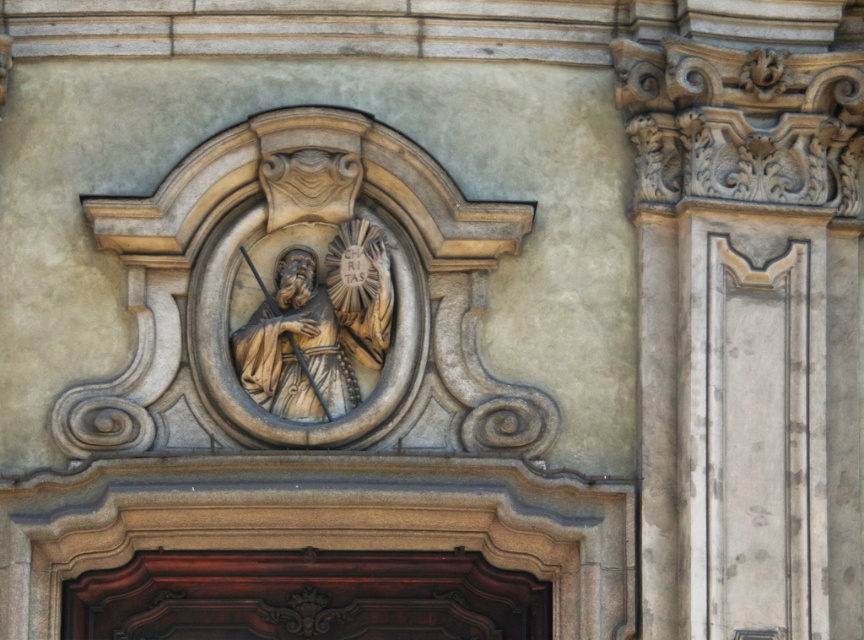
Question: Can you confirm if polished dark wood door at center is wider than matte stone statue at center?

Choices:
 (A) no
 (B) yes

Answer: (A)

Question: Can you confirm if polished dark wood door at center is bigger than matte stone statue at center?

Choices:
 (A) yes
 (B) no

Answer: (B)

Question: Does polished dark wood door at center appear under matte stone statue at center?

Choices:
 (A) yes
 (B) no

Answer: (A)

Question: Which object appears closest to the camera in this image?

Choices:
 (A) matte stone statue at center
 (B) polished dark wood door at center

Answer: (A)